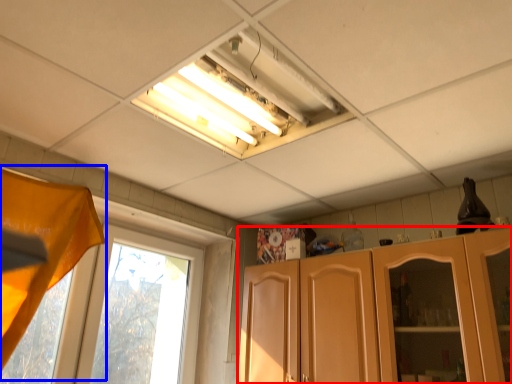
Question: Which point is closer to the camera, cabinetry (highlighted by a red box) or curtain (highlighted by a blue box)?

Choices:
 (A) cabinetry
 (B) curtain

Answer: (B)